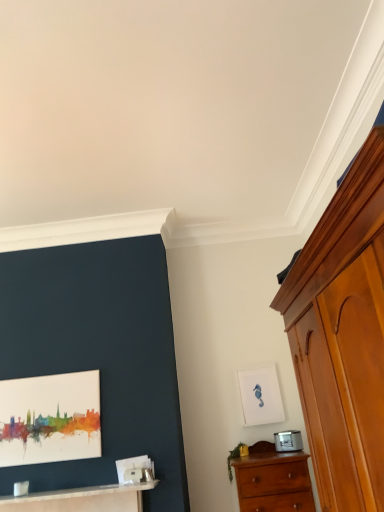
Question: Is wooden chest of drawers at lower right, marked as the 2th chest of drawers in a front-to-back arrangement, shorter than white glossy table at lower left?

Choices:
 (A) no
 (B) yes

Answer: (A)

Question: Is wooden chest of drawers at lower right, the 2th chest of drawers in the top-to-bottom sequence, to the left of white glossy table at lower left from the viewer's perspective?

Choices:
 (A) no
 (B) yes

Answer: (A)

Question: Considering the relative positions of wooden chest of drawers at lower right, which ranks as the 1th chest of drawers in back-to-front order, and white glossy table at lower left in the image provided, is wooden chest of drawers at lower right, which ranks as the 1th chest of drawers in back-to-front order, to the right of white glossy table at lower left from the viewer's perspective?

Choices:
 (A) no
 (B) yes

Answer: (B)

Question: Considering the relative sizes of wooden chest of drawers at lower right, which ranks as the 1th chest of drawers in back-to-front order, and white glossy table at lower left in the image provided, is wooden chest of drawers at lower right, which ranks as the 1th chest of drawers in back-to-front order, taller than white glossy table at lower left?

Choices:
 (A) yes
 (B) no

Answer: (A)

Question: From the image's perspective, is wooden chest of drawers at lower right, which ranks as the 1th chest of drawers in back-to-front order, under white glossy table at lower left?

Choices:
 (A) yes
 (B) no

Answer: (A)

Question: From the image's perspective, is white matte picture frame at upper right, the 2th picture frame from the front, positioned above or below wooden chest of drawers at right, the second chest of drawers when ordered from back to front?

Choices:
 (A) above
 (B) below

Answer: (B)

Question: Considering the positions of white matte picture frame at upper right, which ranks as the second picture frame in left-to-right order, and wooden chest of drawers at right, placed as the 2th chest of drawers when sorted from bottom to top, in the image, is white matte picture frame at upper right, which ranks as the second picture frame in left-to-right order, bigger or smaller than wooden chest of drawers at right, placed as the 2th chest of drawers when sorted from bottom to top,?

Choices:
 (A) big
 (B) small

Answer: (B)

Question: From a real-world perspective, is white matte picture frame at upper right, which ranks as the second picture frame in left-to-right order, physically located above or below wooden chest of drawers at right, the second chest of drawers when ordered from back to front?

Choices:
 (A) above
 (B) below

Answer: (A)

Question: In terms of height, does white matte picture frame at upper right, which ranks as the second picture frame in left-to-right order, look taller or shorter compared to wooden chest of drawers at right, the first chest of drawers positioned from the front?

Choices:
 (A) short
 (B) tall

Answer: (A)

Question: From the image's perspective, is wooden chest of drawers at lower right, the 2th chest of drawers in the top-to-bottom sequence, located above or below white glossy table at lower left?

Choices:
 (A) below
 (B) above

Answer: (A)

Question: From a real-world perspective, relative to white glossy table at lower left, is wooden chest of drawers at lower right, which ranks as the 1th chest of drawers in back-to-front order, vertically above or below?

Choices:
 (A) below
 (B) above

Answer: (A)

Question: Is wooden chest of drawers at lower right, marked as the 2th chest of drawers in a front-to-back arrangement, taller or shorter than white glossy table at lower left?

Choices:
 (A) short
 (B) tall

Answer: (B)

Question: Relative to white glossy table at lower left, is wooden chest of drawers at lower right, the 2th chest of drawers in the top-to-bottom sequence, in front or behind?

Choices:
 (A) behind
 (B) front

Answer: (B)

Question: From the image's perspective, is watercolor paper painting at left, the 2th picture frame when ordered from right to left, above or below wooden chest of drawers at right, the first chest of drawers positioned from the front?

Choices:
 (A) above
 (B) below

Answer: (B)

Question: In the image, is watercolor paper painting at left, the 2th picture frame when ordered from right to left, positioned in front of or behind wooden chest of drawers at right, positioned as the 1th chest of drawers in top-to-bottom order?

Choices:
 (A) front
 (B) behind

Answer: (B)